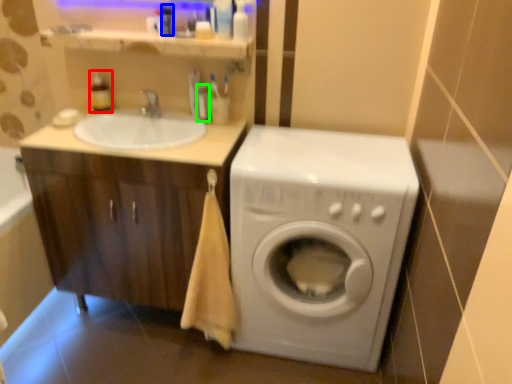
Question: Based on their relative distances, which object is nearer to toiletry (highlighted by a red box)? Choose from toiletry (highlighted by a blue box) and toiletry (highlighted by a green box).

Choices:
 (A) toiletry
 (B) toiletry

Answer: (A)